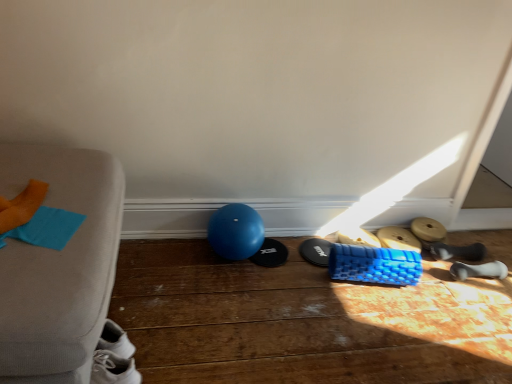
Where is `vacant space to the right of blue rubber ball at center`? vacant space to the right of blue rubber ball at center is located at coordinates (285, 265).